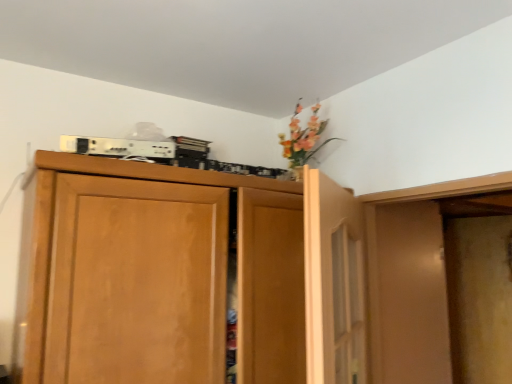
Question: From the image's perspective, is wooden cupboard at upper center under wooden door at upper center?

Choices:
 (A) yes
 (B) no

Answer: (A)

Question: Is wooden cupboard at upper center bigger than wooden door at upper center?

Choices:
 (A) yes
 (B) no

Answer: (A)

Question: From the image's perspective, does wooden cupboard at upper center appear higher than wooden door at upper center?

Choices:
 (A) no
 (B) yes

Answer: (A)

Question: Can you confirm if wooden cupboard at upper center is wider than wooden door at upper center?

Choices:
 (A) no
 (B) yes

Answer: (B)

Question: Is wooden cupboard at upper center completely or partially outside of wooden door at upper center?

Choices:
 (A) yes
 (B) no

Answer: (A)

Question: Considering the relative positions of wooden cupboard at upper center and wooden door at upper center in the image provided, is wooden cupboard at upper center to the right of wooden door at upper center from the viewer's perspective?

Choices:
 (A) yes
 (B) no

Answer: (B)

Question: Does wooden door at upper center have a greater width compared to wooden cupboard at upper center?

Choices:
 (A) yes
 (B) no

Answer: (B)

Question: From the image's perspective, would you say wooden door at upper center is positioned over wooden cupboard at upper center?

Choices:
 (A) yes
 (B) no

Answer: (A)

Question: Can you confirm if wooden door at upper center is shorter than wooden cupboard at upper center?

Choices:
 (A) yes
 (B) no

Answer: (A)

Question: Are wooden door at upper center and wooden cupboard at upper center located far from each other?

Choices:
 (A) yes
 (B) no

Answer: (B)

Question: Does wooden door at upper center appear on the left side of wooden cupboard at upper center?

Choices:
 (A) yes
 (B) no

Answer: (B)

Question: Is wooden door at upper center facing away from wooden cupboard at upper center?

Choices:
 (A) yes
 (B) no

Answer: (A)

Question: Is point pyautogui.click(x=358, y=311) positioned closer to the camera than point pyautogui.click(x=338, y=355)?

Choices:
 (A) farther
 (B) closer

Answer: (A)